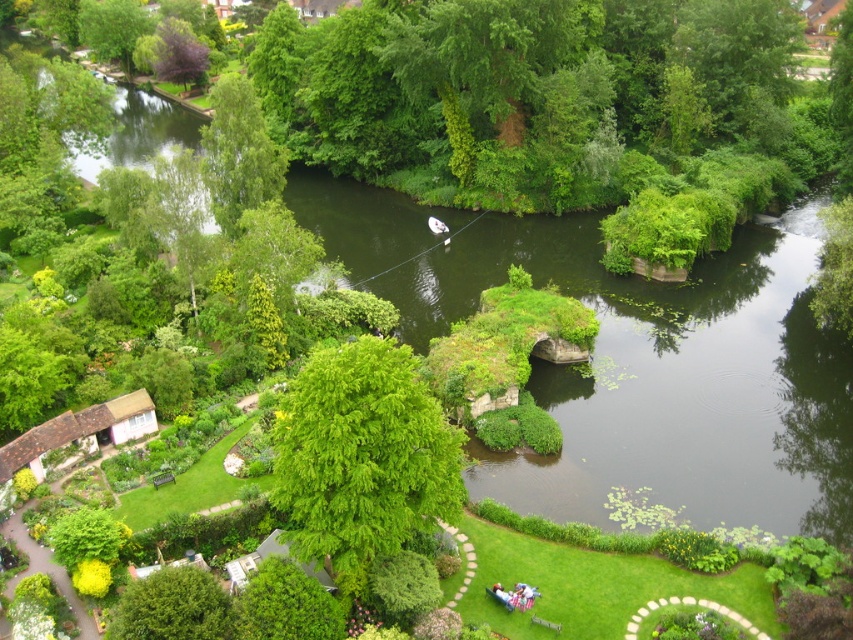
Looking at this image, you are planning to place a large picnic blanket in the garden. The green leafy tree at center and the green leafy tree at lower left are both in the area. Which tree has a wider canopy to provide more shade?

The green leafy tree at center has a wider canopy than the green leafy tree at lower left, so it can provide more shade.

You are standing at the edge of the garden looking towards the water. Which tree would you see first if you look straight ahead? The green leafy tree at center or the purple leafy tree at upper left?

The green leafy tree at center is located below the purple leafy tree at upper left, so you would see the purple leafy tree at upper left first when looking straight ahead.

You are standing at the elevated viewpoint of the garden. There are two points marked in the image, point A at coordinates point (434, 497) and point B at coordinates point (167, 81). Which point is closer to your current position?

Point point (434, 497) is closer to the camera than point point (167, 81), so point A is closer to your current position.